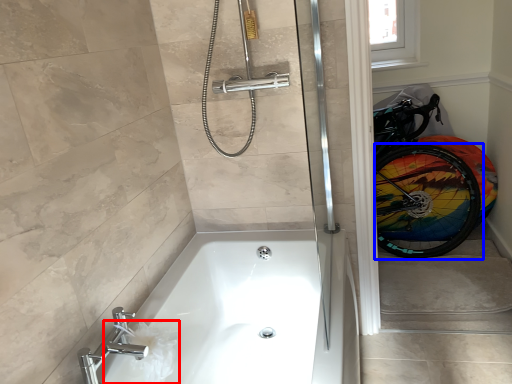
Question: Among these objects, which one is farthest to the camera, toilet paper (highlighted by a red box) or bicycle wheel (highlighted by a blue box)?

Choices:
 (A) toilet paper
 (B) bicycle wheel

Answer: (B)